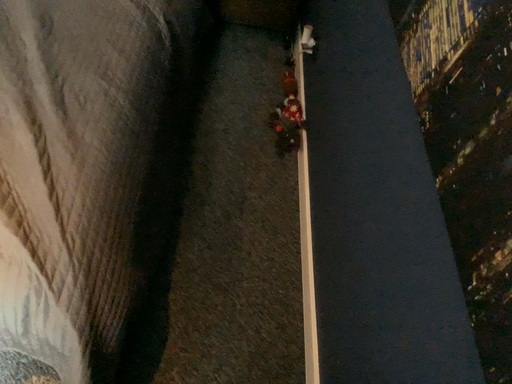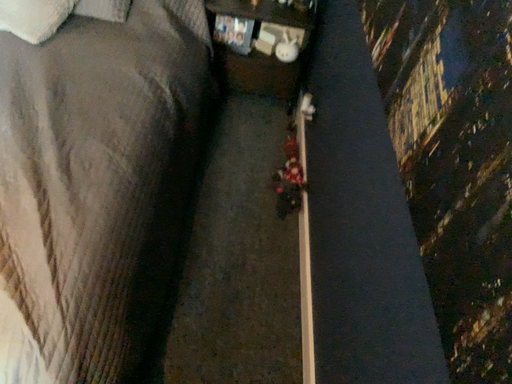
Question: How did the camera likely rotate when shooting the video?

Choices:
 (A) rotated downward
 (B) rotated upward

Answer: (B)